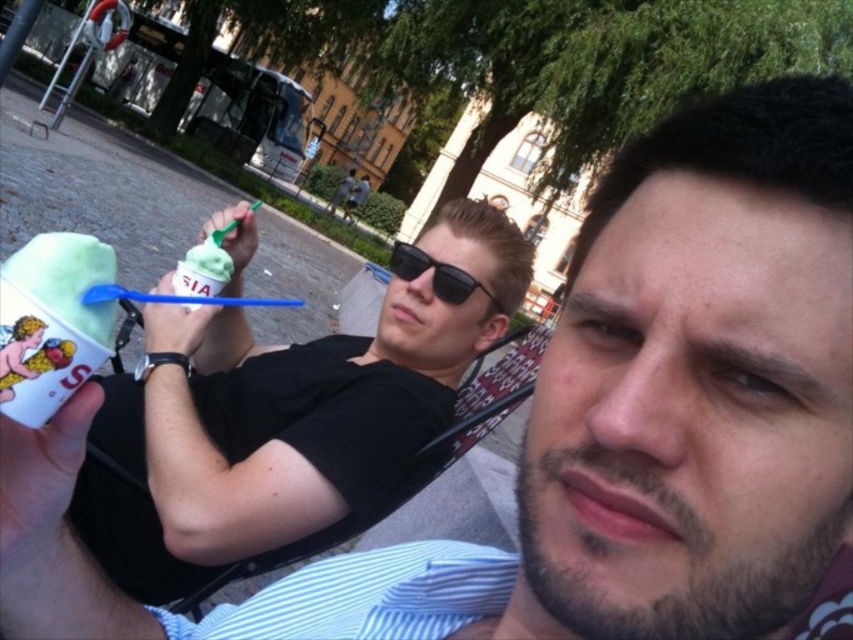
Does green matte ice cream at center have a greater width compared to black plastic sunglasses at center?

Yes, green matte ice cream at center is wider than black plastic sunglasses at center.

Which is behind, point (183, 420) or point (486, 292)?

Positioned behind is point (486, 292).

Image resolution: width=853 pixels, height=640 pixels. Identify the location of green matte ice cream at center. (283, 420).